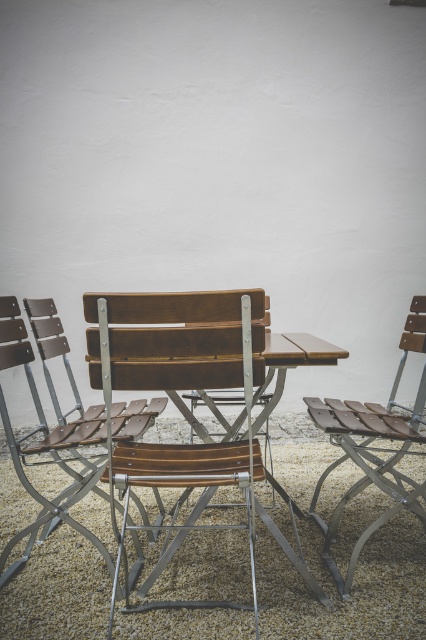
Is point (37, 616) closer to viewer compared to point (408, 332)?

That is True.

Which is more to the right, brown gravel at center or brown wood chair at right?

brown wood chair at right

The width and height of the screenshot is (426, 640). I want to click on brown gravel at center, so click(x=351, y=586).

The height and width of the screenshot is (640, 426). Find the location of `brown gravel at center`. brown gravel at center is located at coordinates (351, 586).

Can you confirm if wooden slats chair at center is positioned above brown wood chair at right?

Correct, wooden slats chair at center is located above brown wood chair at right.

Which is below, wooden slats chair at center or brown wood chair at right?

Positioned lower is brown wood chair at right.

The height and width of the screenshot is (640, 426). What are the coordinates of `wooden slats chair at center` in the screenshot? It's located at (176, 385).

Find the location of a particular element. This screenshot has height=640, width=426. wooden slats chair at center is located at coordinates (176, 385).

Between brown gravel at center and brown leather chair at center, which one has less height?

With less height is brown gravel at center.

Does brown gravel at center have a lesser width compared to brown leather chair at center?

In fact, brown gravel at center might be wider than brown leather chair at center.

Describe the element at coordinates (351, 586) in the screenshot. I see `brown gravel at center` at that location.

Find the location of a particular element. brown gravel at center is located at coordinates pos(351,586).